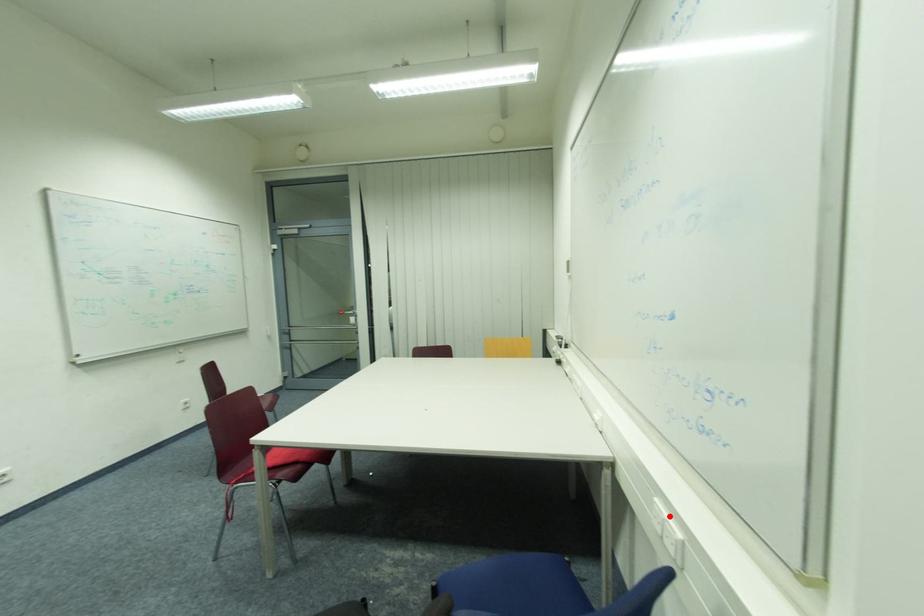
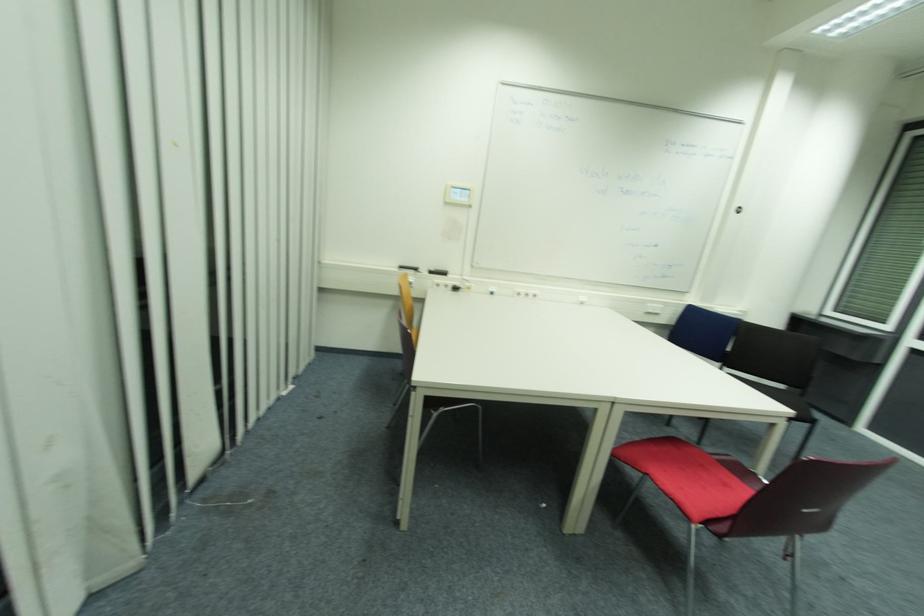
Question: I am providing you with two images of the same scene from different viewpoints. In image1, a red point is highlighted. Considering the same 3D point in image2, which of the following is correct?

Choices:
 (A) It is closer
 (B) It is farther

Answer: (A)